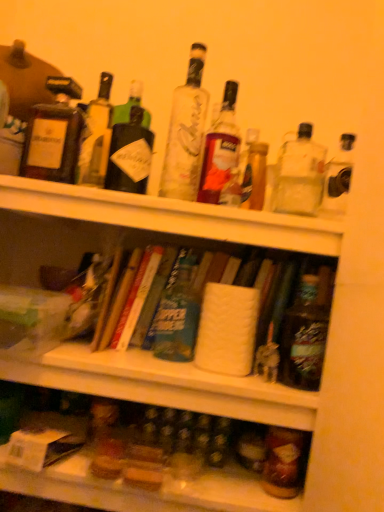
Identify the location of translucent glass bottles at lower center. (146, 490).

What do you see at coordinates (54, 134) in the screenshot? This screenshot has width=384, height=512. I see `matte brown bottle at upper left, which is the ninth bottle in right-to-left order` at bounding box center [54, 134].

This screenshot has height=512, width=384. What do you see at coordinates (135, 298) in the screenshot?
I see `hardcover book at center` at bounding box center [135, 298].

You are a GUI agent. You are given a task and a screenshot of the screen. Output one action in this format:
    pyautogui.click(x=<x>, y=<y>)
    Task: Click on the translucent glass bottles at lower center
    The height and width of the screenshot is (512, 384).
    Given the screenshot: What is the action you would take?
    pyautogui.click(x=146, y=490)

Based on the photo, would you consider matte brown bottle at upper left, which is the ninth bottle in right-to-left order, to be distant from translucent glass bottle at center, placed as the fifth bottle when sorted from right to left?

matte brown bottle at upper left, which is the ninth bottle in right-to-left order, is near translucent glass bottle at center, placed as the fifth bottle when sorted from right to left, not far away.

Would you say matte brown bottle at upper left, which is the 1th bottle from left to right, is outside translucent glass bottle at center, placed as the fifth bottle when sorted from right to left?

Yes, matte brown bottle at upper left, which is the 1th bottle from left to right, is outside of translucent glass bottle at center, placed as the fifth bottle when sorted from right to left.

From a real-world perspective, is matte brown bottle at upper left, which is the ninth bottle in right-to-left order, positioned under translucent glass bottle at center, placed as the fifth bottle when sorted from right to left, based on gravity?

Yes, from a real-world perspective, matte brown bottle at upper left, which is the ninth bottle in right-to-left order, is under translucent glass bottle at center, placed as the fifth bottle when sorted from right to left.

What's the angular difference between translucent glass bottles at lower center and shiny metallic bottle at center, marked as the 1th bottle in a right-to-left arrangement,'s facing directions?

They differ by 0.29 degrees in their facing directions.

Considering the sizes of translucent glass bottles at lower center and shiny metallic bottle at center, the 9th bottle positioned from the left, in the image, is translucent glass bottles at lower center wider or thinner than shiny metallic bottle at center, the 9th bottle positioned from the left,?

In the image, translucent glass bottles at lower center appears to be wider than shiny metallic bottle at center, the 9th bottle positioned from the left.

The image size is (384, 512). In order to click on shelf below the shiny metallic bottle at center, marked as the 1th bottle in a right-to-left arrangement (from the image's perspective) in this screenshot , I will do `click(146, 490)`.

Is shiny metallic bottle at center, the 9th bottle positioned from the left, at the back of translucent glass bottles at lower center?

No, translucent glass bottles at lower center is not facing the opposite direction of shiny metallic bottle at center, the 9th bottle positioned from the left.

Based on the photo, is translucent glass bottles at lower center next to matte brown bottle at upper left, which is the 1th bottle from left to right?

translucent glass bottles at lower center is not next to matte brown bottle at upper left, which is the 1th bottle from left to right, and they're not touching.

Does translucent glass bottles at lower center have a lesser width compared to matte brown bottle at upper left, which is the ninth bottle in right-to-left order?

Incorrect, the width of translucent glass bottles at lower center is not less than that of matte brown bottle at upper left, which is the ninth bottle in right-to-left order.

From a real-world perspective, which is physically above, translucent glass bottles at lower center or matte brown bottle at upper left, which is the 1th bottle from left to right?

matte brown bottle at upper left, which is the 1th bottle from left to right.

Which is in front, point (209, 475) or point (81, 120)?

The point (209, 475) is closer.

From a real-world perspective, is translucent glass bottle at lower right, the third bottle viewed from the right, beneath hardcover book at center?

Yes, from a real-world perspective, translucent glass bottle at lower right, the third bottle viewed from the right, is under hardcover book at center.

Considering the sizes of translucent glass bottle at lower right, marked as the 7th bottle in a left-to-right arrangement, and hardcover book at center in the image, is translucent glass bottle at lower right, marked as the 7th bottle in a left-to-right arrangement, wider or thinner than hardcover book at center?

In the image, translucent glass bottle at lower right, marked as the 7th bottle in a left-to-right arrangement, appears to be more narrow than hardcover book at center.

Who is bigger, translucent glass bottle at lower right, the third bottle viewed from the right, or hardcover book at center?

With larger size is hardcover book at center.

Is clear glass bottle at upper right, the 8th bottle viewed from the left, taller than translucent glass bottles at lower center?

Yes.

In terms of width, does clear glass bottle at upper right, the second bottle viewed from the right, look wider or thinner when compared to translucent glass bottles at lower center?

clear glass bottle at upper right, the second bottle viewed from the right, is thinner than translucent glass bottles at lower center.

From a real-world perspective, is clear glass bottle at upper right, the second bottle viewed from the right, below translucent glass bottles at lower center?

No, from a real-world perspective, clear glass bottle at upper right, the second bottle viewed from the right, is not beneath translucent glass bottles at lower center.

From a real-world perspective, count 5th bottles upward from the translucent glass bottles at lower center and point to it. Please provide its 2D coordinates.

[(299, 175)]

In the scene shown: Is translucent glass bottle at upper center, acting as the fourth bottle starting from the right, positioned with its back to clear glass bottle at upper right, the 8th bottle viewed from the left?

translucent glass bottle at upper center, acting as the fourth bottle starting from the right, is not turned away from clear glass bottle at upper right, the 8th bottle viewed from the left.

Does translucent glass bottle at upper center, acting as the fourth bottle starting from the right, contain clear glass bottle at upper right, the 8th bottle viewed from the left?

No, clear glass bottle at upper right, the 8th bottle viewed from the left, is not surrounded by translucent glass bottle at upper center, acting as the fourth bottle starting from the right.

Is the position of translucent glass bottle at upper center, acting as the fourth bottle starting from the right, less distant than that of clear glass bottle at upper right, the 8th bottle viewed from the left?

No, translucent glass bottle at upper center, acting as the fourth bottle starting from the right, is further to the viewer.

Is clear glass bottle at center, the sixth bottle positioned from the right, inside clear glass bottle at upper right, the 8th bottle viewed from the left?

No, clear glass bottle at upper right, the 8th bottle viewed from the left, does not contain clear glass bottle at center, the sixth bottle positioned from the right.

Can you tell me how much clear glass bottle at upper right, the 8th bottle viewed from the left, and clear glass bottle at center, the sixth bottle positioned from the right, differ in facing direction?

5.05 degrees separate the facing orientations of clear glass bottle at upper right, the 8th bottle viewed from the left, and clear glass bottle at center, the sixth bottle positioned from the right.

Is clear glass bottle at upper right, the 8th bottle viewed from the left, positioned in front of clear glass bottle at center, marked as the fourth bottle in a left-to-right arrangement?

That is True.

Considering the sizes of objects clear glass bottle at upper right, the 8th bottle viewed from the left, and clear glass bottle at center, marked as the fourth bottle in a left-to-right arrangement, in the image provided, who is bigger, clear glass bottle at upper right, the 8th bottle viewed from the left, or clear glass bottle at center, marked as the fourth bottle in a left-to-right arrangement,?

clear glass bottle at center, marked as the fourth bottle in a left-to-right arrangement.

Image resolution: width=384 pixels, height=512 pixels. I want to click on the 4th bottle to the left of the translucent glass bottle at center, which appears as the 5th bottle when viewed from the left, starting your count from the anchor, so click(x=54, y=134).

Locate an element on the screen. This screenshot has height=512, width=384. bottle that is the 3rd one above the translucent glass bottles at lower center (from a real-world perspective) is located at coordinates (306, 332).

When comparing their distances from translucent glass bottle at lower right, the third bottle viewed from the right, does blue matte bagel at center, which ranks as the seventh bottle in right-to-left order, or translucent glass bottle at upper center, acting as the fourth bottle starting from the right, seem further?

translucent glass bottle at upper center, acting as the fourth bottle starting from the right.

From the image, which object appears to be farther from matte brown bottle at upper left, which is the ninth bottle in right-to-left order, translucent glass bottle at upper center, the sixth bottle from the left, or hardcover book at center?

translucent glass bottle at upper center, the sixth bottle from the left.

Which object lies further to the anchor point translucent glass bottle at lower right, the third bottle viewed from the right, clear glass bottle at upper right, the second bottle viewed from the right, or shiny metallic bottle at center, the 9th bottle positioned from the left?

Based on the image, clear glass bottle at upper right, the second bottle viewed from the right, appears to be further to translucent glass bottle at lower right, the third bottle viewed from the right.

Based on their spatial positions, is translucent glass bottle at lower right, the third bottle viewed from the right, or translucent glass bottle at upper center, the sixth bottle from the left, further from blue matte bagel at center, which ranks as the seventh bottle in right-to-left order?

The object further to blue matte bagel at center, which ranks as the seventh bottle in right-to-left order, is translucent glass bottle at lower right, the third bottle viewed from the right.

Estimate the real-world distances between objects in this image. Which object is further from matte brown bottle at upper left, which is the 1th bottle from left to right, translucent glass bottles at lower center or translucent glass bottle at center, which appears as the 5th bottle when viewed from the left?

translucent glass bottles at lower center is positioned further to the anchor matte brown bottle at upper left, which is the 1th bottle from left to right.

Based on their spatial positions, is green glass bottle at upper left, arranged as the 2th bottle when viewed from the left, or shiny metallic bottle at center, marked as the 1th bottle in a right-to-left arrangement, closer to translucent glass bottle at center, which appears as the 5th bottle when viewed from the left?

green glass bottle at upper left, arranged as the 2th bottle when viewed from the left.

From the image, which object appears to be nearer to green glass bottle at upper left, arranged as the 2th bottle when viewed from the left, translucent glass bottle at lower right, the third bottle viewed from the right, or shiny metallic bottle at center, marked as the 1th bottle in a right-to-left arrangement?

shiny metallic bottle at center, marked as the 1th bottle in a right-to-left arrangement, is positioned closer to the anchor green glass bottle at upper left, arranged as the 2th bottle when viewed from the left.

Considering their positions, is hardcover book at center positioned closer to blue matte bagel at center, which ranks as the seventh bottle in right-to-left order, than translucent glass bottle at upper center, acting as the fourth bottle starting from the right?

hardcover book at center is positioned closer to the anchor blue matte bagel at center, which ranks as the seventh bottle in right-to-left order.

Where is `book that lies between matte brown bottle at upper left, which is the 1th bottle from left to right, and blue matte bagel at center, which ranks as the seventh bottle in right-to-left order, from top to bottom`? book that lies between matte brown bottle at upper left, which is the 1th bottle from left to right, and blue matte bagel at center, which ranks as the seventh bottle in right-to-left order, from top to bottom is located at coordinates (135, 298).

Find the location of a particular element. This screenshot has height=512, width=384. book between clear glass bottle at center, marked as the fourth bottle in a left-to-right arrangement, and shiny metallic bottle at center, the 9th bottle positioned from the left, from top to bottom is located at coordinates (135, 298).

Locate an element on the screen. Image resolution: width=384 pixels, height=512 pixels. book between green glass bottle at upper left, arranged as the 2th bottle when viewed from the left, and translucent glass bottle at lower right, marked as the 7th bottle in a left-to-right arrangement, vertically is located at coordinates (135, 298).

Where is `book between clear glass bottle at center, marked as the fourth bottle in a left-to-right arrangement, and translucent glass bottles at lower center in the up-down direction`? Image resolution: width=384 pixels, height=512 pixels. book between clear glass bottle at center, marked as the fourth bottle in a left-to-right arrangement, and translucent glass bottles at lower center in the up-down direction is located at coordinates (135, 298).